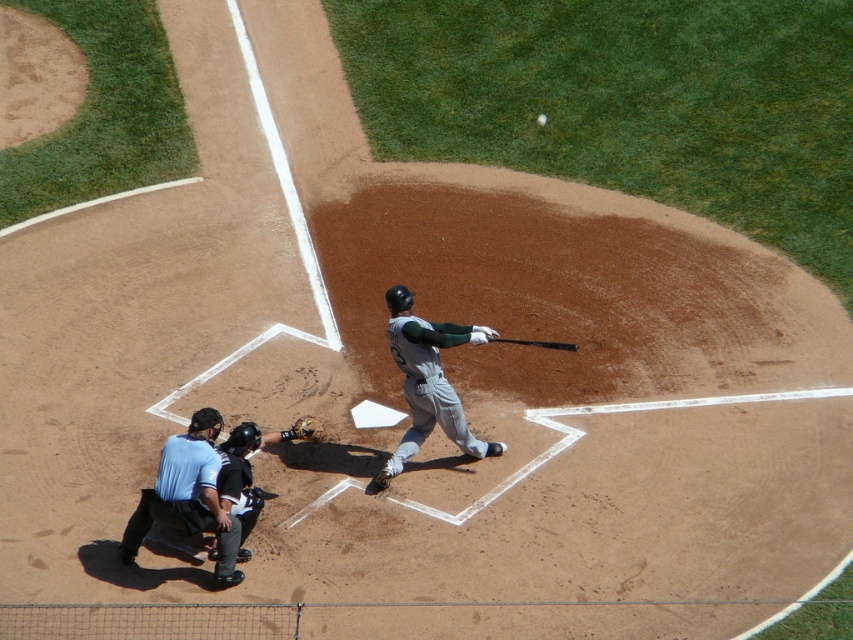
Between point (405, 368) and point (537, 122), which one is positioned behind?

Positioned behind is point (537, 122).

Can you confirm if gray matte uniform at center is wider than white matte baseball at center?

Correct, the width of gray matte uniform at center exceeds that of white matte baseball at center.

Who is more forward, (442, 428) or (540, 115)?

Positioned in front is point (442, 428).

The image size is (853, 640). What are the coordinates of `gray matte uniform at center` in the screenshot? It's located at (428, 380).

Is point (241, 506) positioned before point (321, 429)?

Yes, point (241, 506) is in front of point (321, 429).

Who is more forward, (225, 508) or (321, 440)?

Point (225, 508) is more forward.

Which is in front, point (241, 532) or point (305, 417)?

Point (241, 532) is in front.

This screenshot has height=640, width=853. I want to click on black leather glove at lower center, so click(x=250, y=465).

Is point (180, 513) positioned in front of point (469, 324)?

Yes, it is in front of point (469, 324).

Which is below, blue shirt at lower left or gray matte uniform at center?

Positioned lower is blue shirt at lower left.

Measure the distance between point (207, 451) and camera.

Point (207, 451) and camera are 9.46 meters apart.

At what (x,y) coordinates should I click in order to perform the action: click on blue shirt at lower left. Please return your answer as a coordinate pair (x, y). Looking at the image, I should click on (189, 497).